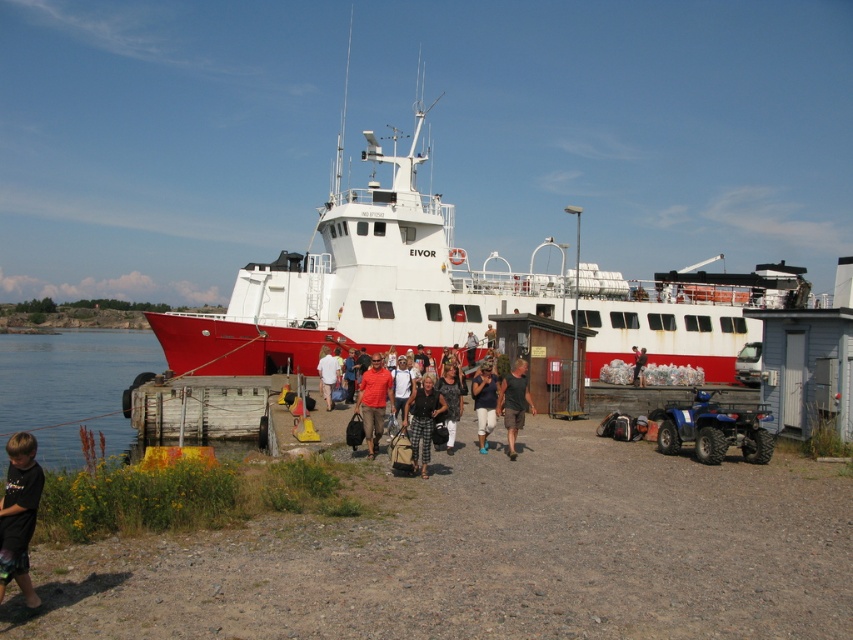
Question: Among these objects, which one is nearest to the camera?

Choices:
 (A) matte orange shirt at center
 (B) matte black shorts at center
 (C) black textured dress at center
 (D) plaid fabric pants at center

Answer: (D)

Question: Which object is the farthest from the plaid fabric pants at center?

Choices:
 (A) red matte ship at center
 (B) wooden dock at lower left
 (C) dark gray fabric shirt at center
 (D) matte red shirt at center

Answer: (A)

Question: Can you confirm if wooden dock at lower left is positioned below dark gray fabric shorts at center?

Choices:
 (A) no
 (B) yes

Answer: (B)

Question: Can you confirm if dirt ground at center is positioned to the left of dark gray fabric shorts at center?

Choices:
 (A) no
 (B) yes

Answer: (B)

Question: Which point is closer to the camera taking this photo?

Choices:
 (A) (637, 365)
 (B) (234, 406)
 (C) (480, 372)
 (D) (447, 416)

Answer: (D)

Question: Is the position of matte black shorts at center less distant than that of plaid fabric pants at center?

Choices:
 (A) yes
 (B) no

Answer: (B)